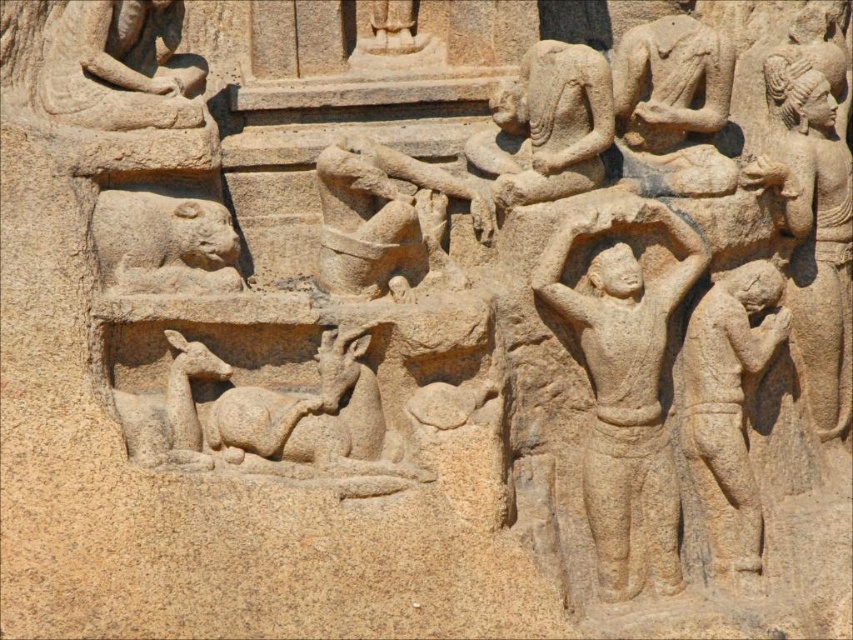
You are an archaeologist examining the ancient stone carving. You notice the smooth stone figure at right and the smooth stone lion at lower left. Which of these two objects is bigger in size?

The smooth stone figure at right is larger in size than the smooth stone lion at lower left.

Based on the scene described, which smooth stone figure is positioned lower in the carving? The smooth stone figure at center or the smooth stone figure at upper left?

The smooth stone figure at center is located below the smooth stone figure at upper left, so the smooth stone figure at center is positioned lower in the carving.

You are an archaeologist examining the ancient stone carving. You notice the smooth stone figure at right and the smooth stone lion at lower left. Which of these two objects has a smaller width?

The smooth stone figure at right is thinner than the smooth stone lion at lower left, so the smooth stone figure at right has a smaller width.